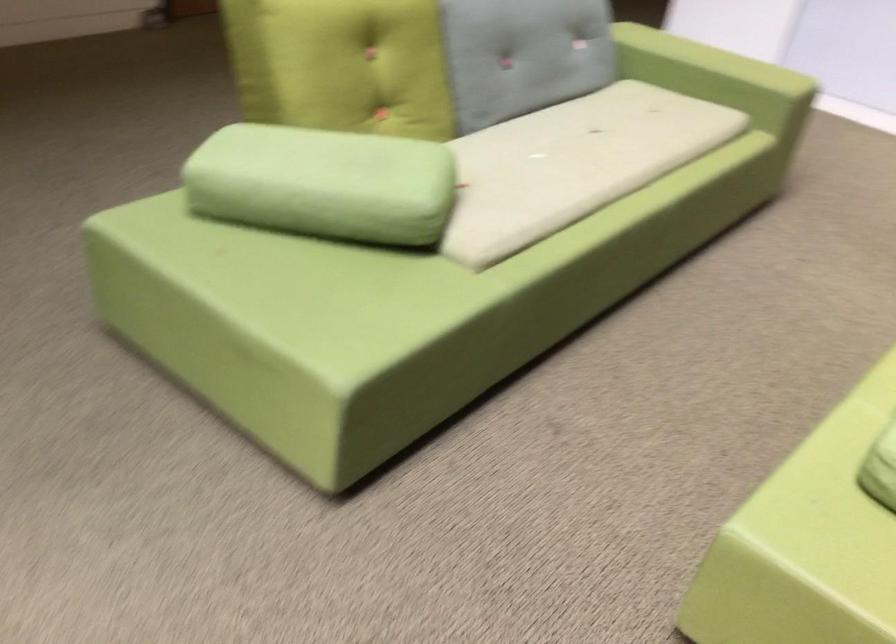
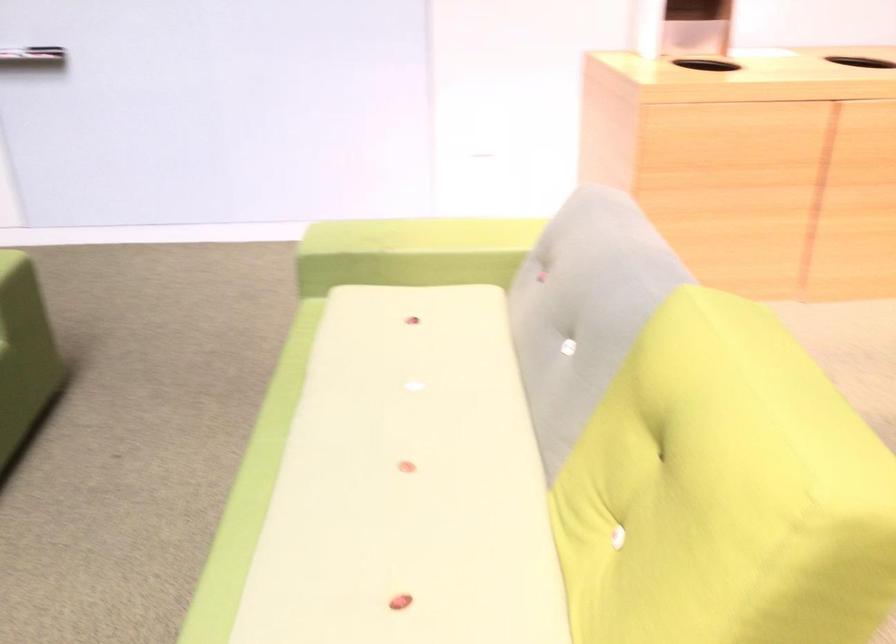
Question: The first image is from the beginning of the video and the second image is from the end. How did the camera likely rotate when shooting the video?

Choices:
 (A) Left
 (B) Right
 (C) Up
 (D) Down

Answer: (B)